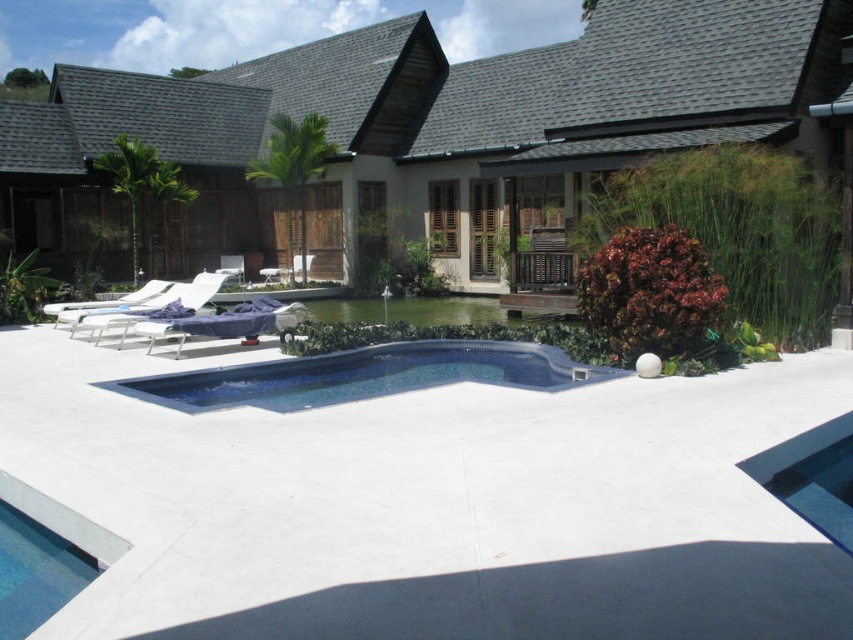
Question: Does smooth concrete pool at center appear under blue glossy swimming pool at center?

Choices:
 (A) no
 (B) yes

Answer: (A)

Question: Which point is closer to the camera taking this photo?

Choices:
 (A) (498, 348)
 (B) (474, 120)

Answer: (A)

Question: Does smooth concrete pool at center appear under blue glossy swimming pool at center?

Choices:
 (A) yes
 (B) no

Answer: (B)

Question: Which object is farther from the camera taking this photo?

Choices:
 (A) smooth concrete pool at center
 (B) blue glossy swimming pool at center

Answer: (A)

Question: Is smooth concrete pool at center above blue glossy swimming pool at center?

Choices:
 (A) yes
 (B) no

Answer: (A)